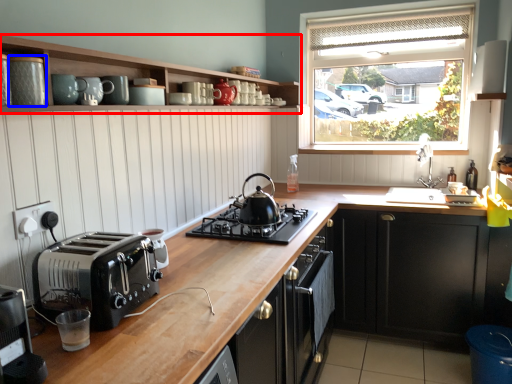
Question: Which object appears closest to the camera in this image, cabinetry (highlighted by a red box) or appliance (highlighted by a blue box)?

Choices:
 (A) cabinetry
 (B) appliance

Answer: (A)